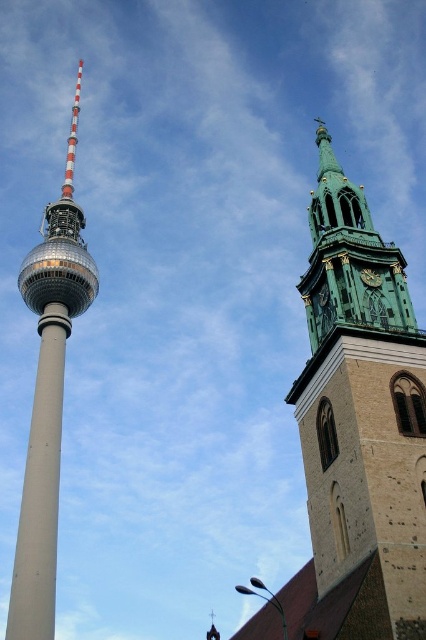
Question: Which object is the closest to the dark green stone clock at upper right?

Choices:
 (A) green patina steeple at right
 (B) smooth gray pole at left

Answer: (A)

Question: Which point is farther to the camera?

Choices:
 (A) green patina steeple at right
 (B) smooth gray pole at left
 (C) dark green stone clock at upper right

Answer: (B)

Question: Can you confirm if green patina steeple at right is positioned to the right of smooth gray pole at left?

Choices:
 (A) yes
 (B) no

Answer: (A)

Question: Does green patina steeple at right lie behind smooth gray pole at left?

Choices:
 (A) no
 (B) yes

Answer: (A)

Question: Does green patina steeple at right have a greater width compared to smooth gray pole at left?

Choices:
 (A) no
 (B) yes

Answer: (B)

Question: Which of the following is the closest to the observer?

Choices:
 (A) (328, 314)
 (B) (28, 474)

Answer: (A)